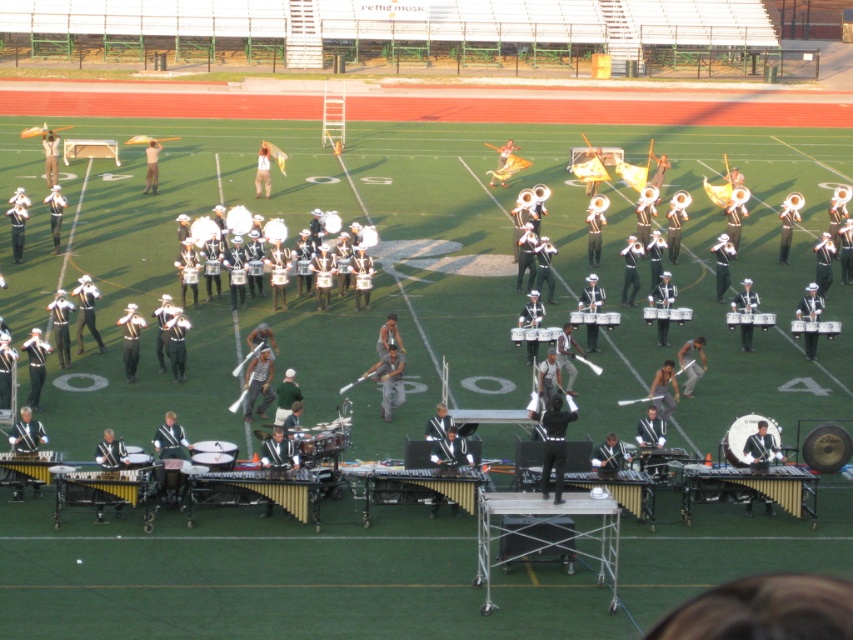
Question: Which point is farther to the camera?

Choices:
 (A) matte black drum at center
 (B) shiny silver drum at center
 (C) metallic silver drum at center
 (D) shiny silver drums at center

Answer: (D)

Question: Based on their relative distances, which object is farther from the shiny silver drum at center?

Choices:
 (A) shiny silver drums at center
 (B) metallic silver drums at center
 (C) metallic silver drum at center

Answer: (A)

Question: Considering the relative positions of shiny silver drum at center and metallic silver drums at center in the image provided, where is shiny silver drum at center located with respect to metallic silver drums at center?

Choices:
 (A) below
 (B) above

Answer: (A)

Question: Which of the following is the farthest from the observer?

Choices:
 (A) (772, 317)
 (B) (804, 321)
 (C) (669, 308)

Answer: (C)

Question: Considering the relative positions of shiny silver drum at center and metallic silver drums at center in the image provided, where is shiny silver drum at center located with respect to metallic silver drums at center?

Choices:
 (A) above
 (B) below

Answer: (B)

Question: Does shiny silver drum at center appear on the left side of metallic silver drum at center?

Choices:
 (A) no
 (B) yes

Answer: (B)